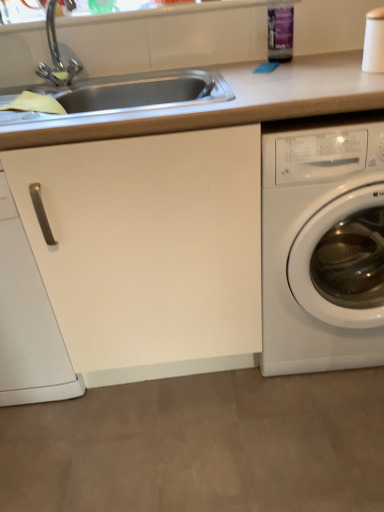
Question: Is white glossy washing machine at right facing towards white matte cabinet handle at left?

Choices:
 (A) no
 (B) yes

Answer: (A)

Question: Is white glossy washing machine at right to the left of white matte cabinet handle at left from the viewer's perspective?

Choices:
 (A) yes
 (B) no

Answer: (B)

Question: Does white glossy washing machine at right have a smaller size compared to white matte cabinet handle at left?

Choices:
 (A) no
 (B) yes

Answer: (A)

Question: From a real-world perspective, does white glossy washing machine at right stand above white matte cabinet handle at left?

Choices:
 (A) no
 (B) yes

Answer: (A)

Question: Is white matte cabinet handle at left at the back of white glossy washing machine at right?

Choices:
 (A) yes
 (B) no

Answer: (B)

Question: From the image's perspective, is white matte cabinet handle at left positioned above or below smooth beige countertop at center?

Choices:
 (A) below
 (B) above

Answer: (A)

Question: Is white matte cabinet handle at left inside or outside of smooth beige countertop at center?

Choices:
 (A) inside
 (B) outside

Answer: (A)

Question: Looking at the image, does white matte cabinet handle at left seem bigger or smaller compared to smooth beige countertop at center?

Choices:
 (A) big
 (B) small

Answer: (B)

Question: Considering the positions of white matte cabinet handle at left and smooth beige countertop at center in the image, is white matte cabinet handle at left taller or shorter than smooth beige countertop at center?

Choices:
 (A) short
 (B) tall

Answer: (A)

Question: Which is correct: smooth beige countertop at center is inside white glossy washing machine at right, or outside of it?

Choices:
 (A) outside
 (B) inside

Answer: (B)

Question: In terms of size, does smooth beige countertop at center appear bigger or smaller than white glossy washing machine at right?

Choices:
 (A) big
 (B) small

Answer: (A)

Question: Considering the positions of smooth beige countertop at center and white glossy washing machine at right in the image, is smooth beige countertop at center taller or shorter than white glossy washing machine at right?

Choices:
 (A) short
 (B) tall

Answer: (B)

Question: Would you say smooth beige countertop at center is to the left or to the right of white glossy washing machine at right in the picture?

Choices:
 (A) right
 (B) left

Answer: (B)

Question: Is point (355, 323) positioned closer to the camera than point (74, 226)?

Choices:
 (A) closer
 (B) farther

Answer: (B)

Question: Considering the positions of white glossy washing machine at right and smooth beige countertop at center in the image, is white glossy washing machine at right wider or thinner than smooth beige countertop at center?

Choices:
 (A) thin
 (B) wide

Answer: (B)